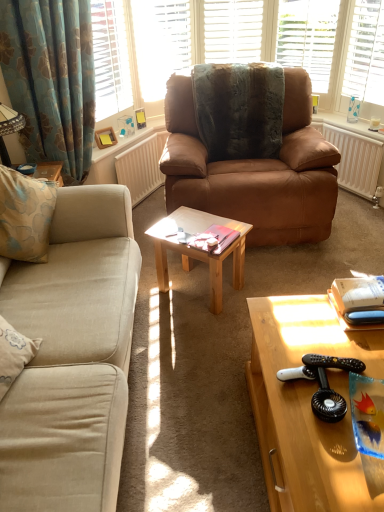
What are the coordinates of `vacant space behind matte wooden picture frame at upper left` in the screenshot? It's located at (x=118, y=138).